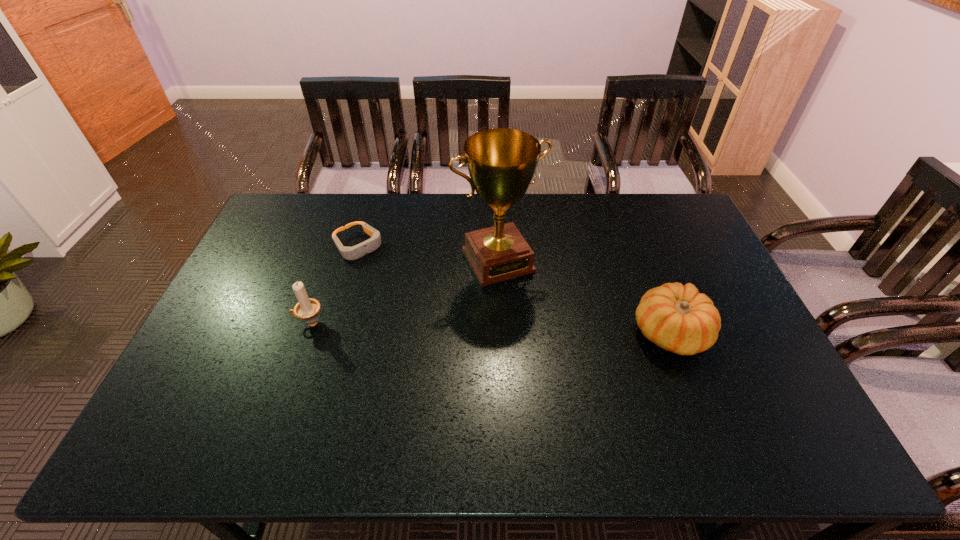
The height and width of the screenshot is (540, 960). In order to click on vacant area between the second shortest object and the candle_holder in this screenshot , I will do `click(490, 328)`.

Locate an element on the screen. vacant point located between the second object from right to left and the shortest object is located at coordinates (428, 253).

At what (x,y) coordinates should I click in order to perform the action: click on blank region between the third object from left to right and the shortest object. Please return your answer as a coordinate pair (x, y). Looking at the image, I should click on (428, 253).

Image resolution: width=960 pixels, height=540 pixels. I want to click on free space between the third shortest object and the second shortest object, so click(x=490, y=328).

Identify which object is the second closest to the second shortest object. Please provide its 2D coordinates. Your answer should be formatted as a tuple, i.e. [(x, y)], where the tuple contains the x and y coordinates of a point satisfying the conditions above.

[(349, 253)]

Image resolution: width=960 pixels, height=540 pixels. I want to click on object that is the second closest one to the third tallest object, so click(x=349, y=253).

Identify the location of free spot that satisfies the following two spatial constraints: 1. on the front side of the goggles; 2. on the left side of the award. (353, 261).

Where is `vacant point that satisfies the following two spatial constraints: 1. on the front side of the shortest object; 2. on the right side of the award`? Image resolution: width=960 pixels, height=540 pixels. vacant point that satisfies the following two spatial constraints: 1. on the front side of the shortest object; 2. on the right side of the award is located at coordinates (353, 261).